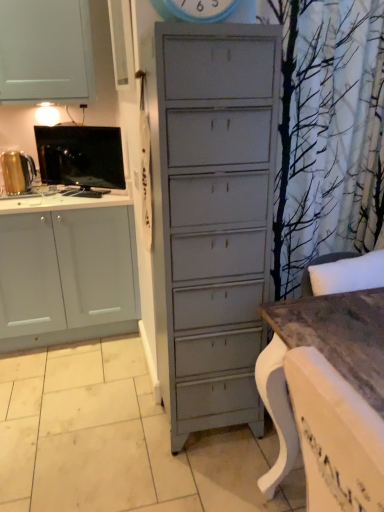
Question: Does wooden table at lower right turn towards gold metallic kettle at left, the 2th appliance positioned from the right?

Choices:
 (A) yes
 (B) no

Answer: (B)

Question: Considering the relative sizes of wooden table at lower right and gold metallic kettle at left, which ranks as the first appliance in left-to-right order, in the image provided, is wooden table at lower right thinner than gold metallic kettle at left, which ranks as the first appliance in left-to-right order,?

Choices:
 (A) no
 (B) yes

Answer: (A)

Question: Does wooden table at lower right have a lesser height compared to gold metallic kettle at left, the 2th appliance positioned from the right?

Choices:
 (A) no
 (B) yes

Answer: (A)

Question: Is wooden table at lower right closer to the viewer compared to gold metallic kettle at left, the 2th appliance positioned from the right?

Choices:
 (A) no
 (B) yes

Answer: (B)

Question: Is wooden table at lower right next to gold metallic kettle at left, which ranks as the first appliance in left-to-right order, and touching it?

Choices:
 (A) yes
 (B) no

Answer: (B)

Question: From a real-world perspective, is wooden table at lower right under gold metallic kettle at left, which ranks as the first appliance in left-to-right order?

Choices:
 (A) no
 (B) yes

Answer: (B)

Question: Is black glossy tv at left, arranged as the first appliance when viewed from the right, facing towards gold metallic kettle at left, which ranks as the first appliance in left-to-right order?

Choices:
 (A) yes
 (B) no

Answer: (A)

Question: Is black glossy tv at left, arranged as the first appliance when viewed from the right, not inside gold metallic kettle at left, the 2th appliance positioned from the right?

Choices:
 (A) yes
 (B) no

Answer: (A)

Question: From the image's perspective, is black glossy tv at left, arranged as the first appliance when viewed from the right, beneath gold metallic kettle at left, the 2th appliance positioned from the right?

Choices:
 (A) no
 (B) yes

Answer: (A)

Question: Is black glossy tv at left, arranged as the first appliance when viewed from the right, closer to the viewer compared to gold metallic kettle at left, which ranks as the first appliance in left-to-right order?

Choices:
 (A) no
 (B) yes

Answer: (B)

Question: Can you see black glossy tv at left, the 2th appliance from the left, touching gold metallic kettle at left, which ranks as the first appliance in left-to-right order?

Choices:
 (A) yes
 (B) no

Answer: (B)

Question: Is black glossy tv at left, arranged as the first appliance when viewed from the right, bigger than gold metallic kettle at left, which ranks as the first appliance in left-to-right order?

Choices:
 (A) yes
 (B) no

Answer: (A)

Question: Does wooden table at lower right appear on the right side of black glossy tv at left, the 2th appliance from the left?

Choices:
 (A) yes
 (B) no

Answer: (A)